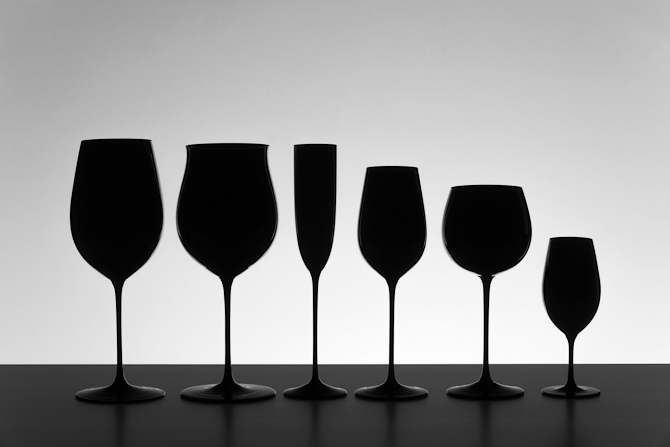
At what (x,y) coordinates should I click in order to perform the action: click on base of wine glasses. Please return your answer as a coordinate pair (x, y). This screenshot has width=670, height=447. Looking at the image, I should click on (135, 398), (218, 389), (293, 387), (386, 393), (567, 390), (469, 393).